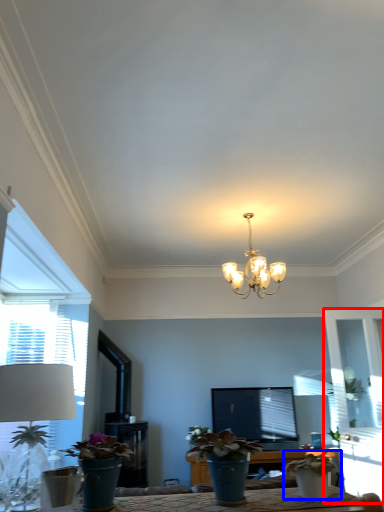
Question: Which object appears closest to the camera in this image, glass door (highlighted by a red box) or houseplant (highlighted by a blue box)?

Choices:
 (A) glass door
 (B) houseplant

Answer: (B)